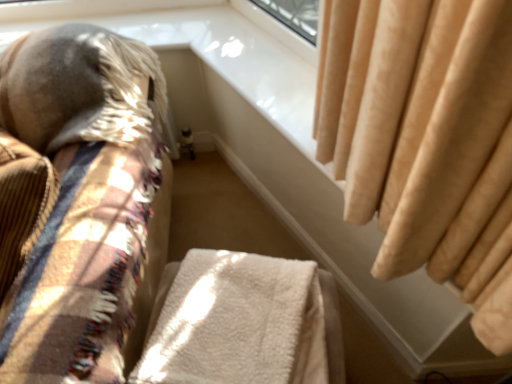
Question: Should I look upward or downward to see soft beige fabric cushion at left?

Choices:
 (A) up
 (B) down

Answer: (B)

Question: Is soft beige fabric cushion at left completely or partially outside of beige velvet curtain at upper right?

Choices:
 (A) no
 (B) yes

Answer: (B)

Question: From a real-world perspective, is soft beige fabric cushion at left beneath beige velvet curtain at upper right?

Choices:
 (A) yes
 (B) no

Answer: (A)

Question: From the image's perspective, is soft beige fabric cushion at left below beige velvet curtain at upper right?

Choices:
 (A) no
 (B) yes

Answer: (B)

Question: Does soft beige fabric cushion at left appear on the left side of beige velvet curtain at upper right?

Choices:
 (A) yes
 (B) no

Answer: (A)

Question: Can you confirm if soft beige fabric cushion at left is shorter than beige velvet curtain at upper right?

Choices:
 (A) no
 (B) yes

Answer: (A)

Question: Can you confirm if soft beige fabric cushion at left is positioned to the right of beige velvet curtain at upper right?

Choices:
 (A) no
 (B) yes

Answer: (A)

Question: Is white fluffy blanket at center taller than beige velvet curtain at upper right?

Choices:
 (A) no
 (B) yes

Answer: (B)

Question: Is the depth of white fluffy blanket at center less than that of beige velvet curtain at upper right?

Choices:
 (A) no
 (B) yes

Answer: (B)

Question: Is white fluffy blanket at center shorter than beige velvet curtain at upper right?

Choices:
 (A) yes
 (B) no

Answer: (B)

Question: Is white fluffy blanket at center turned away from beige velvet curtain at upper right?

Choices:
 (A) no
 (B) yes

Answer: (B)

Question: From a real-world perspective, is white fluffy blanket at center over beige velvet curtain at upper right?

Choices:
 (A) yes
 (B) no

Answer: (B)

Question: Is white fluffy blanket at center to the left of beige velvet curtain at upper right from the viewer's perspective?

Choices:
 (A) no
 (B) yes

Answer: (B)

Question: Is soft beige fabric cushion at left behind white fluffy blanket at center?

Choices:
 (A) no
 (B) yes

Answer: (A)